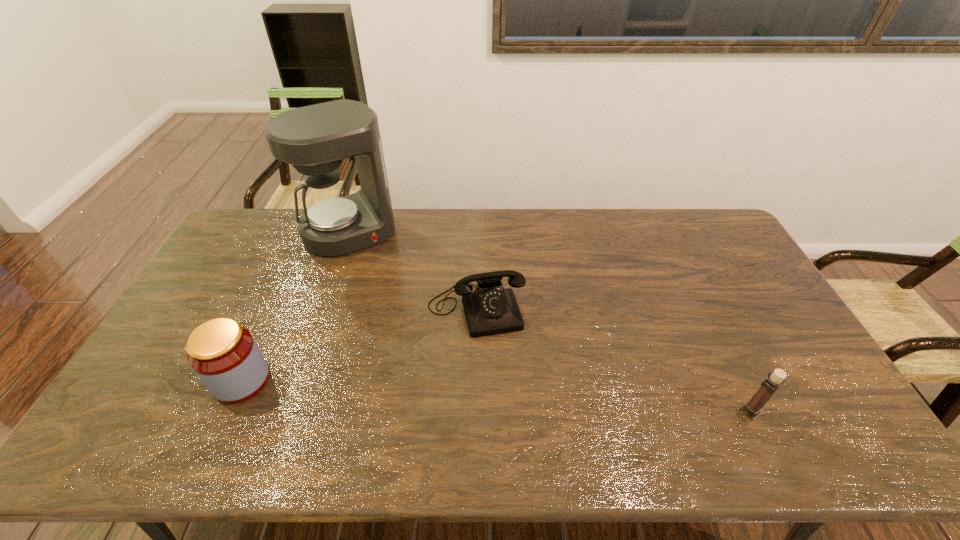
Find the location of a particular element. Image resolution: width=960 pixels, height=540 pixels. free space on the desktop that is between the jar and the candle holder and is positioned on the front face of the third nearest object is located at coordinates (498, 396).

Find the location of a particular element. The height and width of the screenshot is (540, 960). free space on the desktop that is between the jar and the rightmost object and is positioned on the button side of the tallest object is located at coordinates (441, 393).